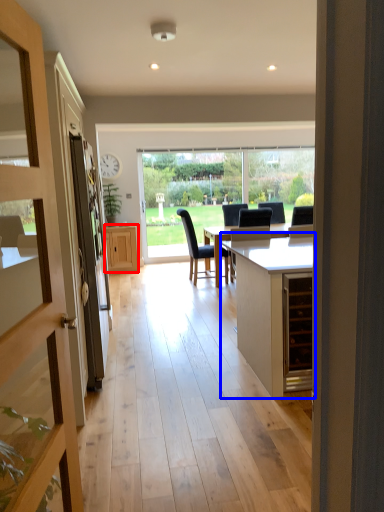
Question: Which object is further to the camera taking this photo, cabinetry (highlighted by a red box) or cabinetry (highlighted by a blue box)?

Choices:
 (A) cabinetry
 (B) cabinetry

Answer: (A)